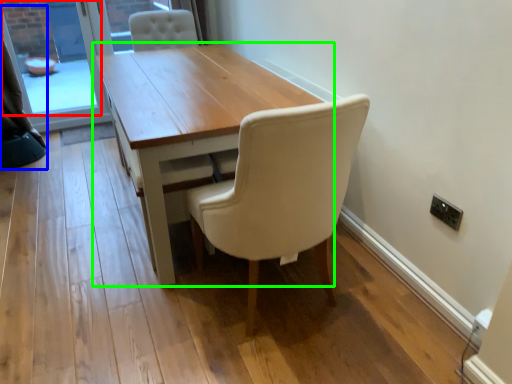
Question: Based on their relative distances, which object is farther from window screen (highlighted by a red box)? Choose from curtain (highlighted by a blue box) and table (highlighted by a green box).

Choices:
 (A) curtain
 (B) table

Answer: (B)